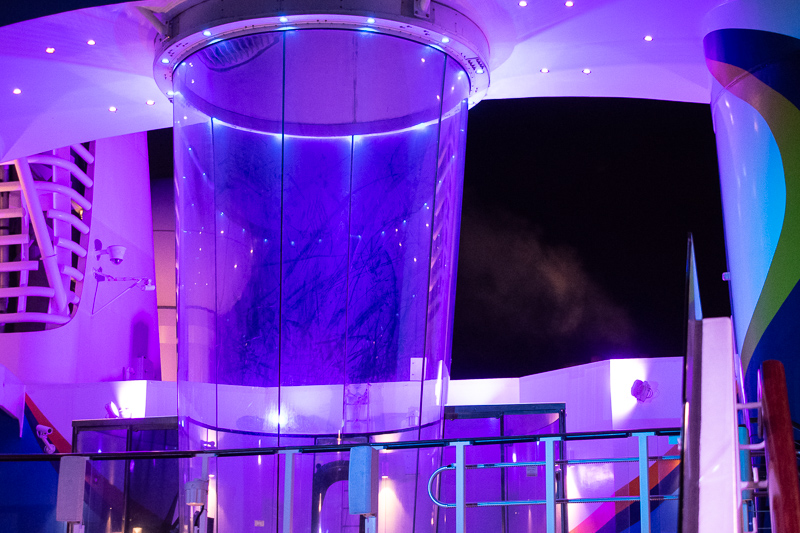
Find the location of `light blue paint`. light blue paint is located at coordinates (666, 528), (782, 351), (30, 497).